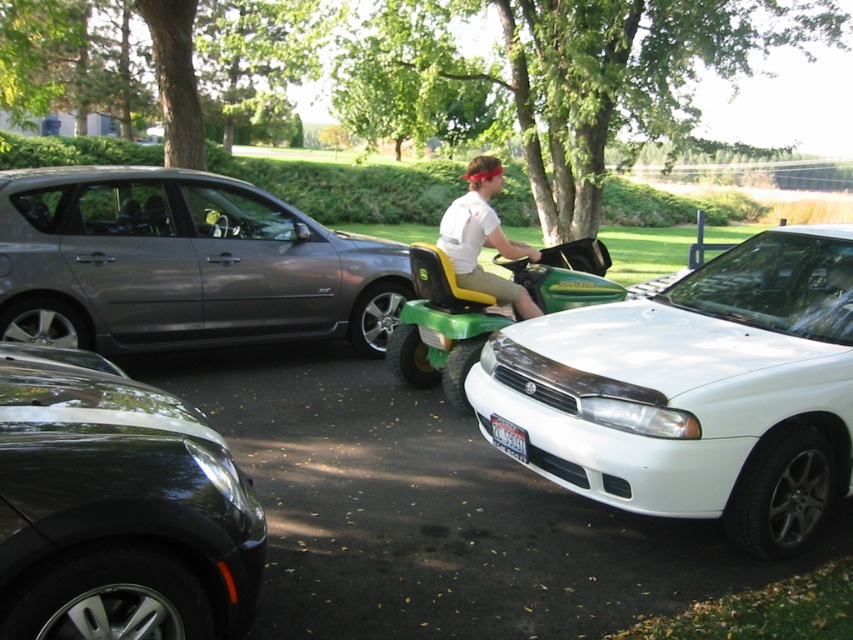
Question: Estimate the real-world distances between objects in this image. Which object is farther from the glossy black car at lower left?

Choices:
 (A) green plastic lawn mower at center
 (B) white glossy sedan at center
 (C) metallic gray hatchback at left

Answer: (C)

Question: Which point is closer to the camera?

Choices:
 (A) (515, 451)
 (B) (77, 525)
 (C) (430, 330)
 (D) (526, 250)

Answer: (B)

Question: Is white glossy sedan at center behind white matte shirt at center?

Choices:
 (A) no
 (B) yes

Answer: (A)

Question: Estimate the real-world distances between objects in this image. Which object is farther from the glossy black car at lower left?

Choices:
 (A) green plastic lawn mower at center
 (B) white glossy sedan at center
 (C) metallic gray hatchback at left
 (D) white matte shirt at center

Answer: (C)

Question: Does glossy black car at lower left come in front of green plastic lawn mower at center?

Choices:
 (A) no
 (B) yes

Answer: (B)

Question: Is glossy black car at lower left smaller than white plastic license plate at lower center?

Choices:
 (A) yes
 (B) no

Answer: (B)